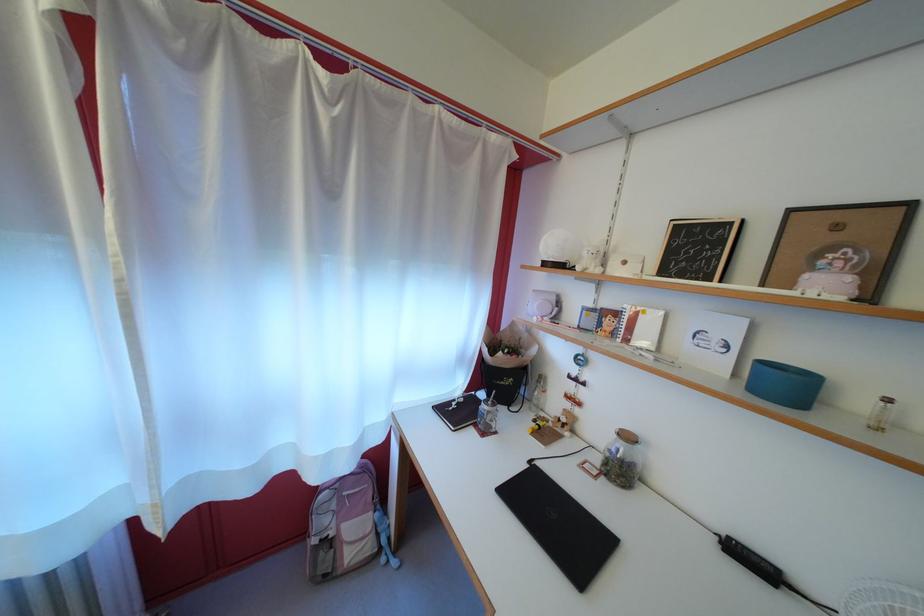
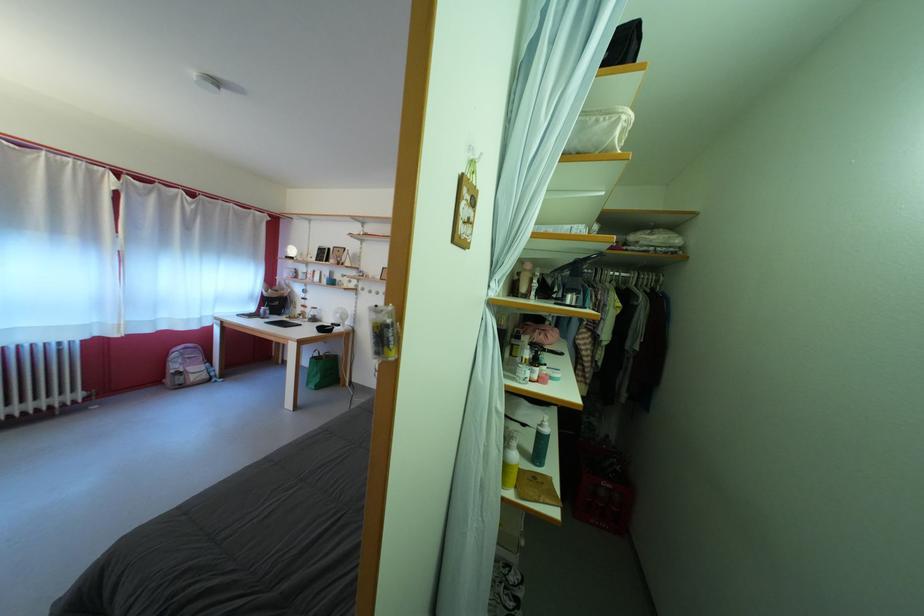
Locate, in the second image, the point that corresponds to point (331, 529) in the first image.

(184, 373)